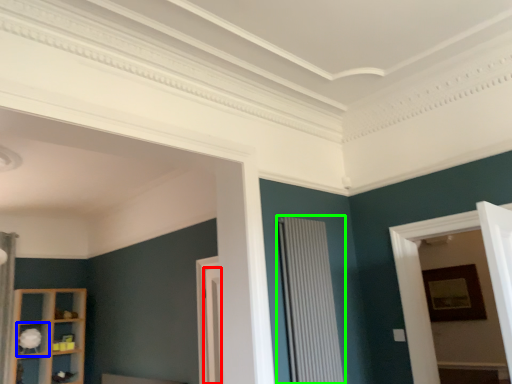
Question: Estimate the real-world distances between objects in this image. Which object is closer to door (highlighted by a red box), shelf (highlighted by a blue box) or radiator (highlighted by a green box)?

Choices:
 (A) shelf
 (B) radiator

Answer: (B)